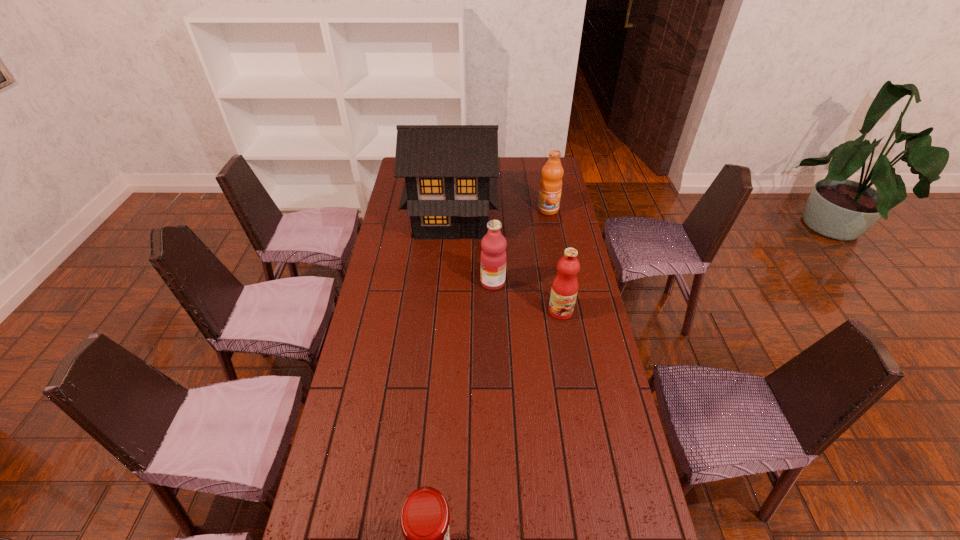
You are a GUI agent. You are given a task and a screenshot of the screen. Output one action in this format:
    pyautogui.click(x=<x>, y=<y>)
    Task: Click on the vacant region between the dollhouse and the farthest fruit juice
    This screenshot has height=540, width=960.
    Given the screenshot: What is the action you would take?
    pyautogui.click(x=500, y=213)

Select which object is the second closest to the fourth farthest object. Please provide its 2D coordinates. Your answer should be formatted as a tuple, i.e. [(x, y)], where the tuple contains the x and y coordinates of a point satisfying the conditions above.

[(451, 171)]

Identify which object is the second closest to the farthest fruit juice. Please provide its 2D coordinates. Your answer should be formatted as a tuple, i.e. [(x, y)], where the tuple contains the x and y coordinates of a point satisfying the conditions above.

[(493, 257)]

Locate an element on the screen. The width and height of the screenshot is (960, 540). fruit juice that is the closest to the dollhouse is located at coordinates (493, 257).

Identify the location of fruit juice that is the second closest to the farthest fruit juice. (564, 289).

I want to click on blank area in the image that satisfies the following two spatial constraints: 1. on the label side of the farthest fruit juice; 2. on the label of the second nearest fruit juice, so click(x=562, y=282).

Where is `free spot that satisfies the following two spatial constraints: 1. on the label side of the farthest fruit juice; 2. on the label of the second farthest fruit juice`? Image resolution: width=960 pixels, height=540 pixels. free spot that satisfies the following two spatial constraints: 1. on the label side of the farthest fruit juice; 2. on the label of the second farthest fruit juice is located at coordinates (562, 282).

At what (x,y) coordinates should I click in order to perform the action: click on vacant region that satisfies the following two spatial constraints: 1. on the label side of the farthest fruit juice; 2. on the label of the third farthest object. Please return your answer as a coordinate pair (x, y). Looking at the image, I should click on (562, 282).